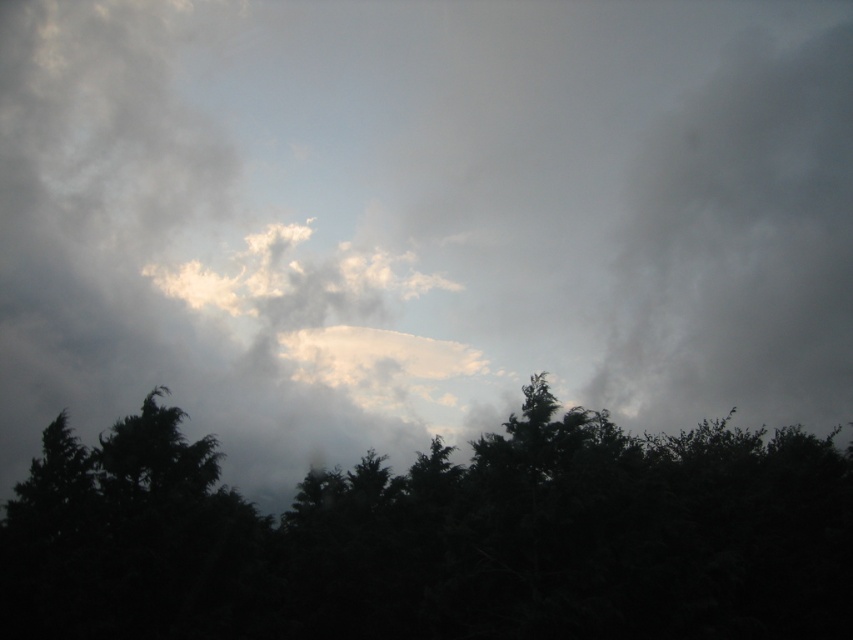
Question: Which of the following is the farthest from the observer?

Choices:
 (A) dark gray cloud at right
 (B) dark green foliage at center

Answer: (A)

Question: Considering the relative positions of dark green foliage at center and dark gray cloud at right in the image provided, where is dark green foliage at center located with respect to dark gray cloud at right?

Choices:
 (A) right
 (B) left

Answer: (B)

Question: Can you confirm if dark green foliage at center is positioned to the right of dark gray cloud at right?

Choices:
 (A) no
 (B) yes

Answer: (A)

Question: Which object appears closest to the camera in this image?

Choices:
 (A) dark gray cloud at right
 (B) dark green foliage at center

Answer: (B)

Question: Is dark green foliage at center bigger than dark gray cloud at right?

Choices:
 (A) yes
 (B) no

Answer: (B)